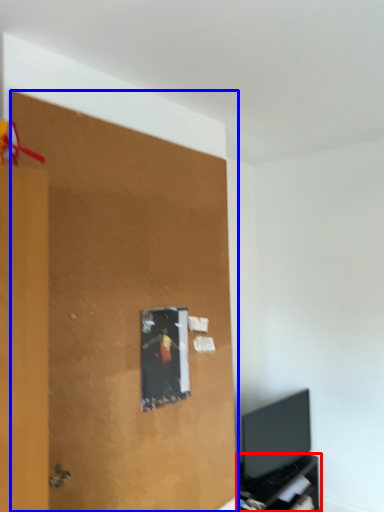
Question: Which object is closer to the camera taking this photo, tv cabinet (highlighted by a red box) or plywood (highlighted by a blue box)?

Choices:
 (A) tv cabinet
 (B) plywood

Answer: (B)